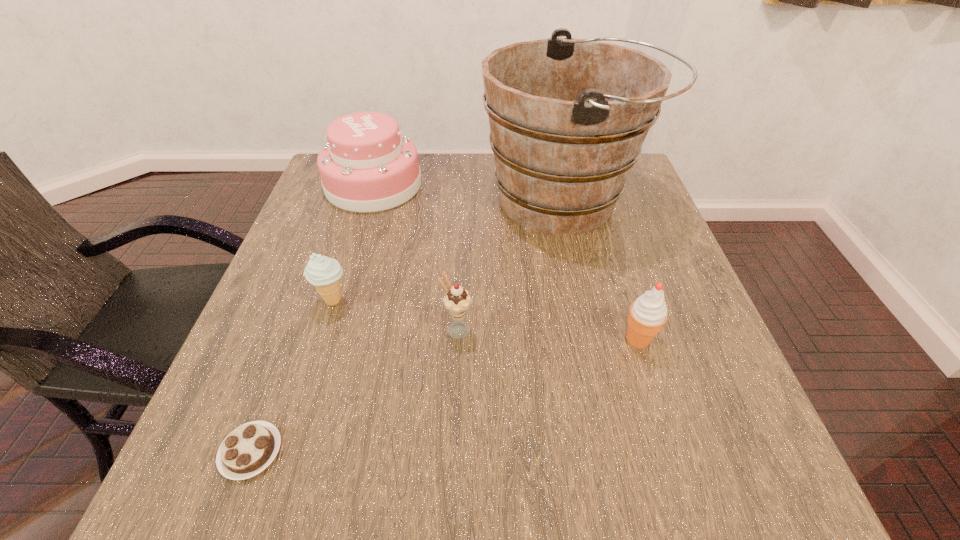
At what (x,y) coordinates should I click in order to perform the action: click on icecream that is the closest to the rightmost icecream. Please return your answer as a coordinate pair (x, y). The image size is (960, 540). Looking at the image, I should click on (457, 301).

You are a GUI agent. You are given a task and a screenshot of the screen. Output one action in this format:
    pyautogui.click(x=<x>, y=<y>)
    Task: Click on the icecream that is the third closest to the bucket
    
    Given the screenshot: What is the action you would take?
    pyautogui.click(x=323, y=272)